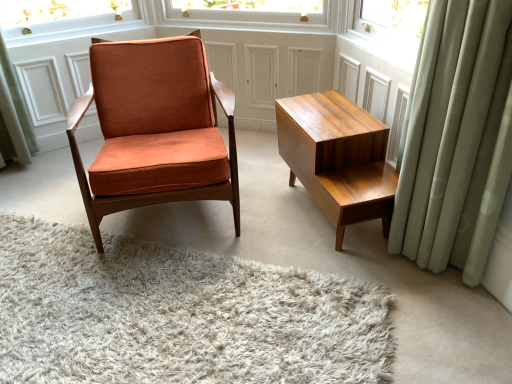
Question: From the image's perspective, is light green fabric curtain at right located above or below white shag rug at center?

Choices:
 (A) below
 (B) above

Answer: (B)

Question: Relative to white shag rug at center, is light green fabric curtain at right in front or behind?

Choices:
 (A) front
 (B) behind

Answer: (B)

Question: Based on their relative distances, which object is nearer to the orange velvet chair at center?

Choices:
 (A) wooden table at right
 (B) light green fabric curtain at right
 (C) white shag rug at center

Answer: (A)

Question: Which of these objects is positioned closest to the orange velvet chair at center?

Choices:
 (A) white shag rug at center
 (B) light green fabric curtain at right
 (C) wooden table at right

Answer: (C)